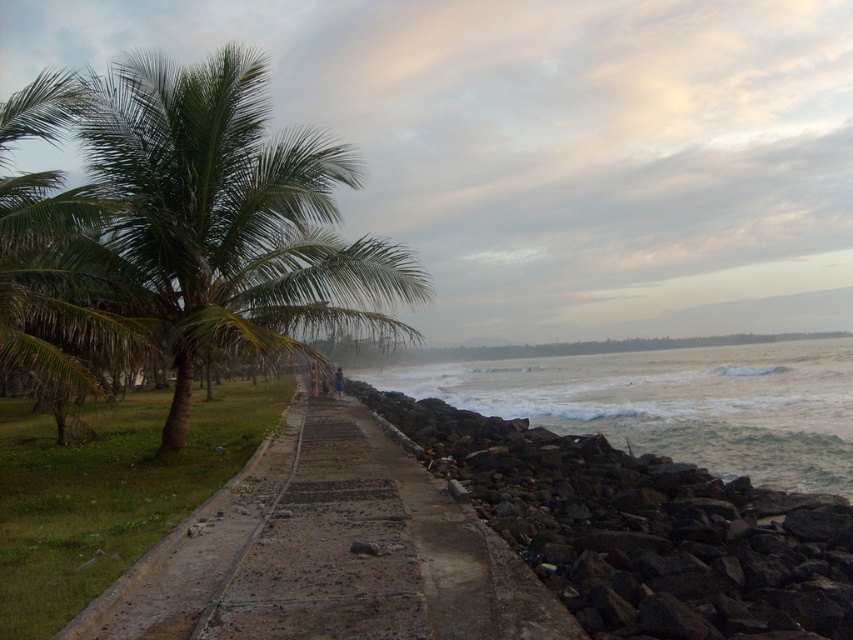
You are standing on the coastal pathway and want to take a photo of both the point at coordinates point (167, 212) and the point at coordinates point (601, 625). Which point should you position yourself closer to in order to capture both points in the same frame without moving the camera?

You should position yourself closer to point (601, 625) because it is farther away from you than point (167, 212), allowing both points to be within the camera frame when closer to the farther point.

You are standing on the concrete at center and want to walk to the white frothy water at right. Is the path downhill or uphill?

The concrete at center is above the white frothy water at right, so the path would be downhill towards the water.